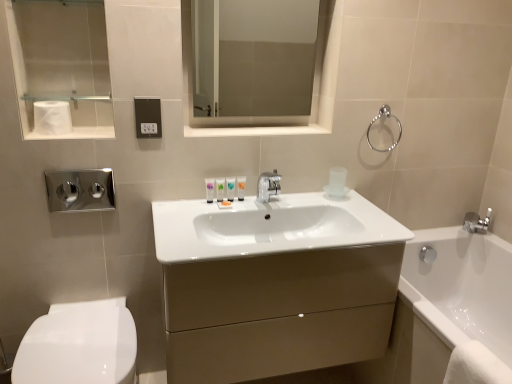
Identify the location of free point to the right of white glossy tube at center, which is the 4th toiletry in left-to-right order. (274, 202).